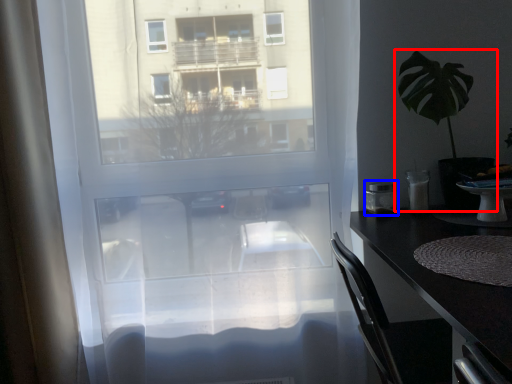
Question: Among these objects, which one is nearest to the camera, houseplant (highlighted by a red box) or appliance (highlighted by a blue box)?

Choices:
 (A) houseplant
 (B) appliance

Answer: (A)